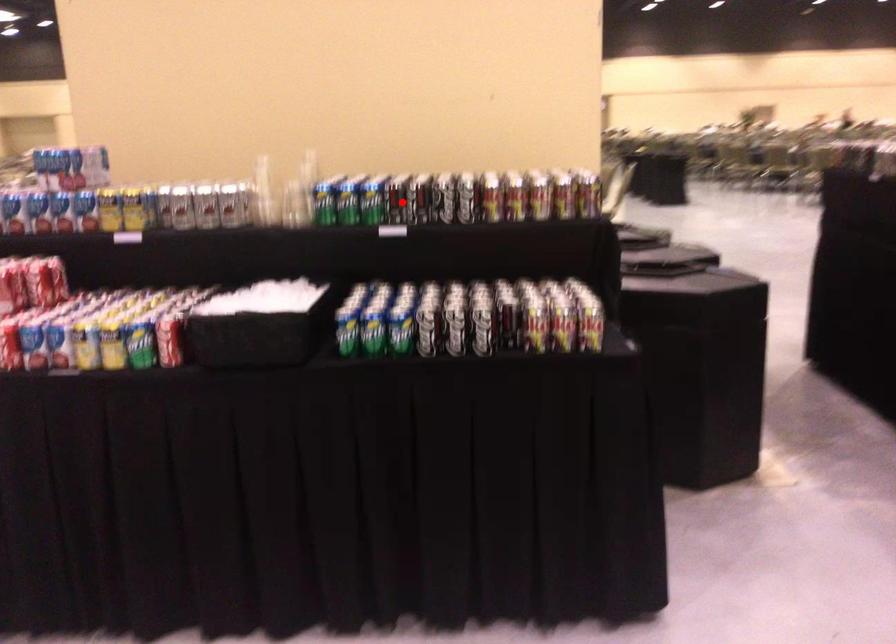
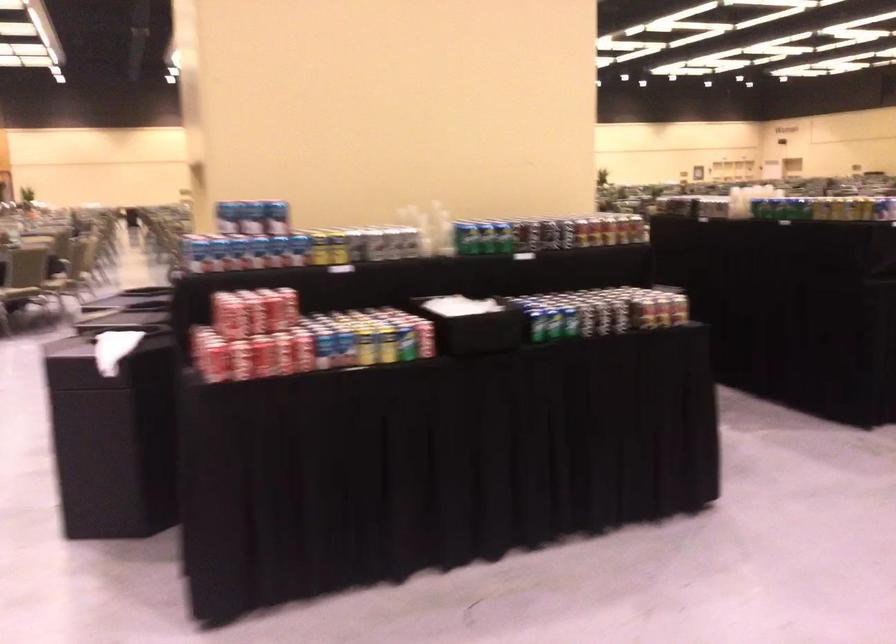
Question: A red point is marked in image1. In image2, is the corresponding 3D point closer to the camera or farther? Reply with the corresponding letter.

Choices:
 (A) The corresponding 3D point is closer.
 (B) The corresponding 3D point is farther.

Answer: (B)